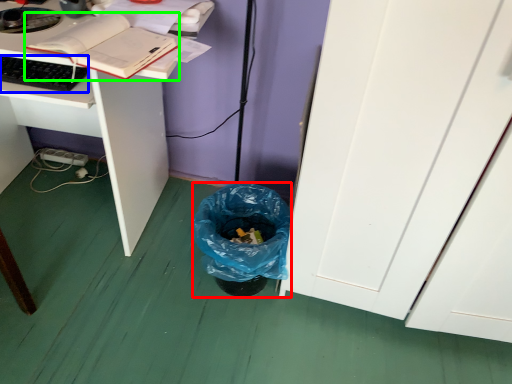
Question: Estimate the real-world distances between objects in this image. Which object is farther from trash bin/can (highlighted by a red box), computer keyboard (highlighted by a blue box) or book (highlighted by a green box)?

Choices:
 (A) computer keyboard
 (B) book

Answer: (A)